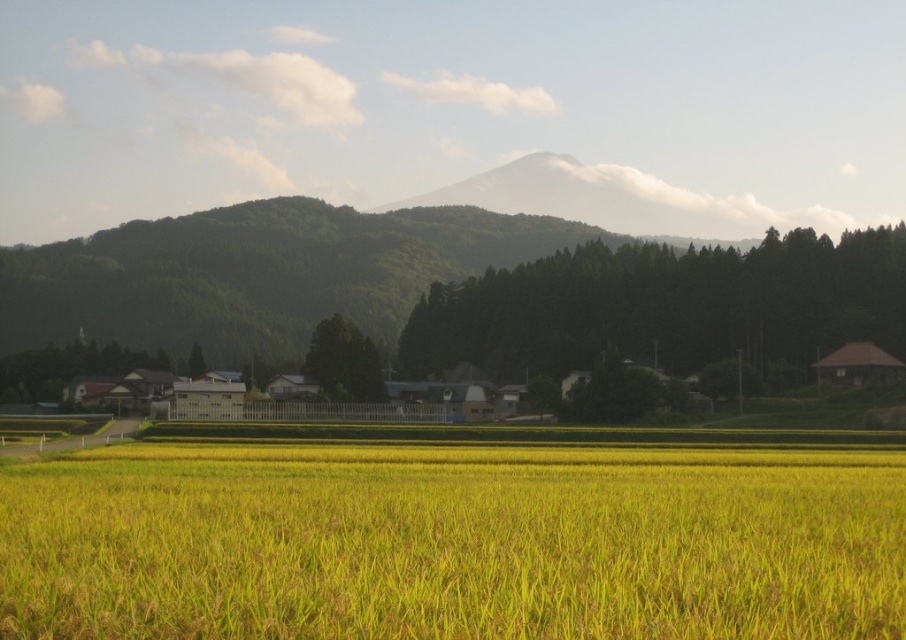
Which is in front, point (680, 604) or point (844, 352)?

Point (680, 604) is in front.

Who is higher up, yellow grass at center or brown wooden hut at right?

yellow grass at center is higher up.

Is point (353, 561) positioned after point (837, 365)?

No, (353, 561) is in front of (837, 365).

At what (x,y) coordinates should I click in order to perform the action: click on yellow grass at center. Please return your answer as a coordinate pair (x, y). Image resolution: width=906 pixels, height=640 pixels. Looking at the image, I should click on (453, 541).